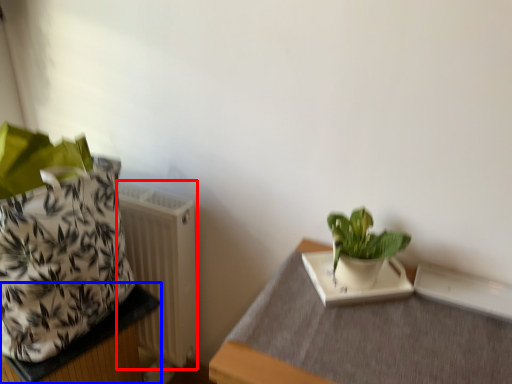
Question: Which point is closer to the camera, radiator (highlighted by a red box) or table (highlighted by a blue box)?

Choices:
 (A) radiator
 (B) table

Answer: (B)